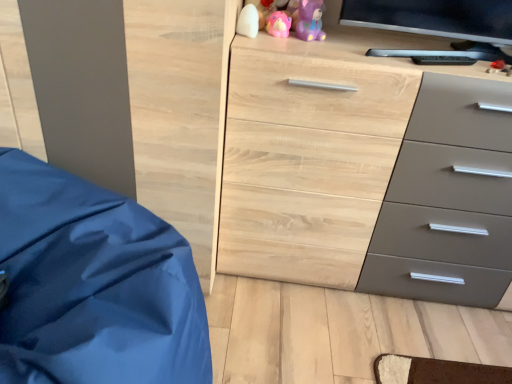
Question: Should I look upward or downward to see white matte pillow at upper center, which appears as the 1th toy when viewed from the left?

Choices:
 (A) down
 (B) up

Answer: (B)

Question: Is white matte pillow at upper center, which appears as the 1th toy when viewed from the left, smaller than pink rubber duck at upper center, which is counted as the 2th toy, starting from the right?

Choices:
 (A) yes
 (B) no

Answer: (A)

Question: Can you confirm if white matte pillow at upper center, the 3th toy in the right-to-left sequence, is positioned to the right of pink rubber duck at upper center, which is counted as the 2th toy, starting from the right?

Choices:
 (A) no
 (B) yes

Answer: (A)

Question: Is white matte pillow at upper center, which appears as the 1th toy when viewed from the left, turned away from pink rubber duck at upper center, the second toy from the left?

Choices:
 (A) no
 (B) yes

Answer: (A)

Question: Is white matte pillow at upper center, the 3th toy in the right-to-left sequence, facing towards pink rubber duck at upper center, the second toy from the left?

Choices:
 (A) no
 (B) yes

Answer: (A)

Question: Can we say white matte pillow at upper center, which appears as the 1th toy when viewed from the left, lies outside pink rubber duck at upper center, the second toy from the left?

Choices:
 (A) yes
 (B) no

Answer: (A)

Question: From a real-world perspective, is white matte pillow at upper center, the 3th toy in the right-to-left sequence, over pink rubber duck at upper center, which is counted as the 2th toy, starting from the right?

Choices:
 (A) yes
 (B) no

Answer: (B)

Question: From the image's perspective, is purple matte bear at upper center, the third toy when ordered from left to right, beneath pink rubber duck at upper center, the second toy from the left?

Choices:
 (A) no
 (B) yes

Answer: (A)

Question: Are purple matte bear at upper center, the third toy when ordered from left to right, and pink rubber duck at upper center, the second toy from the left, making contact?

Choices:
 (A) no
 (B) yes

Answer: (B)

Question: From a real-world perspective, is purple matte bear at upper center, acting as the first toy starting from the right, beneath pink rubber duck at upper center, which is counted as the 2th toy, starting from the right?

Choices:
 (A) no
 (B) yes

Answer: (A)

Question: Is purple matte bear at upper center, the third toy when ordered from left to right, facing away from pink rubber duck at upper center, which is counted as the 2th toy, starting from the right?

Choices:
 (A) no
 (B) yes

Answer: (A)

Question: Would you consider purple matte bear at upper center, acting as the first toy starting from the right, to be distant from pink rubber duck at upper center, which is counted as the 2th toy, starting from the right?

Choices:
 (A) yes
 (B) no

Answer: (B)

Question: Considering the relative positions of purple matte bear at upper center, acting as the first toy starting from the right, and pink rubber duck at upper center, which is counted as the 2th toy, starting from the right, in the image provided, is purple matte bear at upper center, acting as the first toy starting from the right, to the right of pink rubber duck at upper center, which is counted as the 2th toy, starting from the right, from the viewer's perspective?

Choices:
 (A) no
 (B) yes

Answer: (B)

Question: Can you confirm if pink rubber duck at upper center, which is counted as the 2th toy, starting from the right, is smaller than white matte pillow at upper center, the 3th toy in the right-to-left sequence?

Choices:
 (A) no
 (B) yes

Answer: (A)